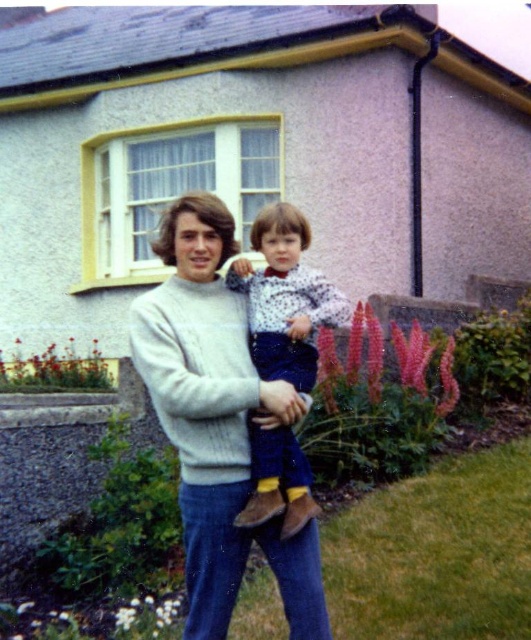
Question: Among these points, which one is nearest to the camera?

Choices:
 (A) (451, 371)
 (B) (430, 353)

Answer: (B)

Question: Is pink fluffy flowers at lower left positioned in front of white matte flower at lower center?

Choices:
 (A) yes
 (B) no

Answer: (B)

Question: Which point is closer to the camera taking this photo?

Choices:
 (A) (186, 532)
 (B) (116, 627)

Answer: (A)

Question: Does polka dot sweater at center have a lesser width compared to pink fuzzy flowers at lower center?

Choices:
 (A) yes
 (B) no

Answer: (A)

Question: Which of the following is the closest to the observer?

Choices:
 (A) (442, 365)
 (B) (415, 346)
 (C) (46, 378)
 (D) (116, 628)

Answer: (D)

Question: Where is polka dot sweater at center located in relation to pink fluffy flower at center in the image?

Choices:
 (A) right
 (B) left

Answer: (B)